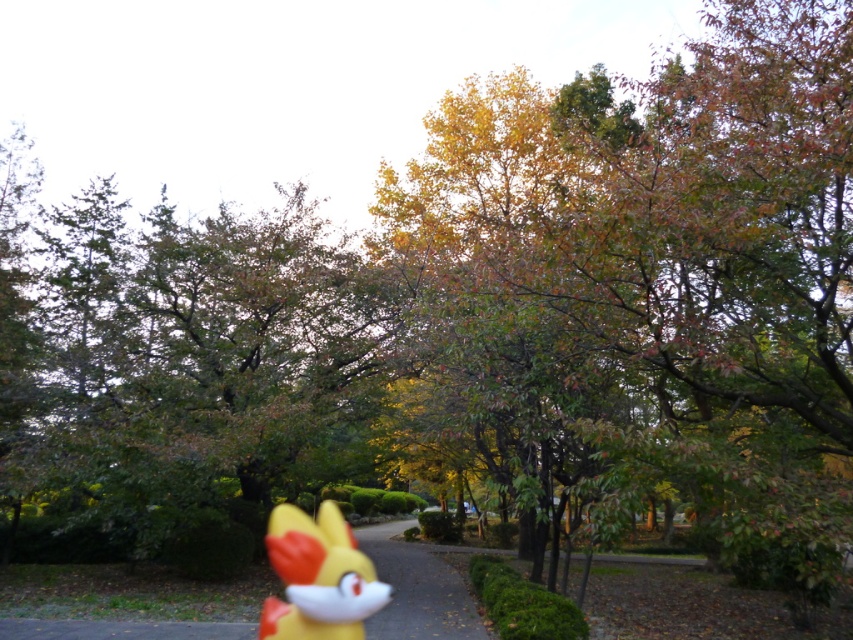
Between yellow plastic toy at center and yellow matte toy at center, which one is positioned lower?

yellow plastic toy at center

Consider the image. Who is taller, yellow plastic toy at center or yellow matte toy at center?

Standing taller between the two is yellow plastic toy at center.

Is point (380, 636) positioned behind point (372, 595)?

No, (380, 636) is closer to viewer.

Locate an element on the screen. yellow plastic toy at center is located at coordinates (416, 589).